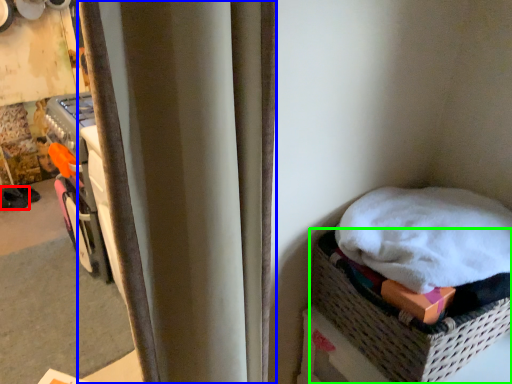
Question: Which is farther away from footwear (highlighted by a red box)? curtain (highlighted by a blue box) or basket (highlighted by a green box)?

Choices:
 (A) curtain
 (B) basket

Answer: (A)